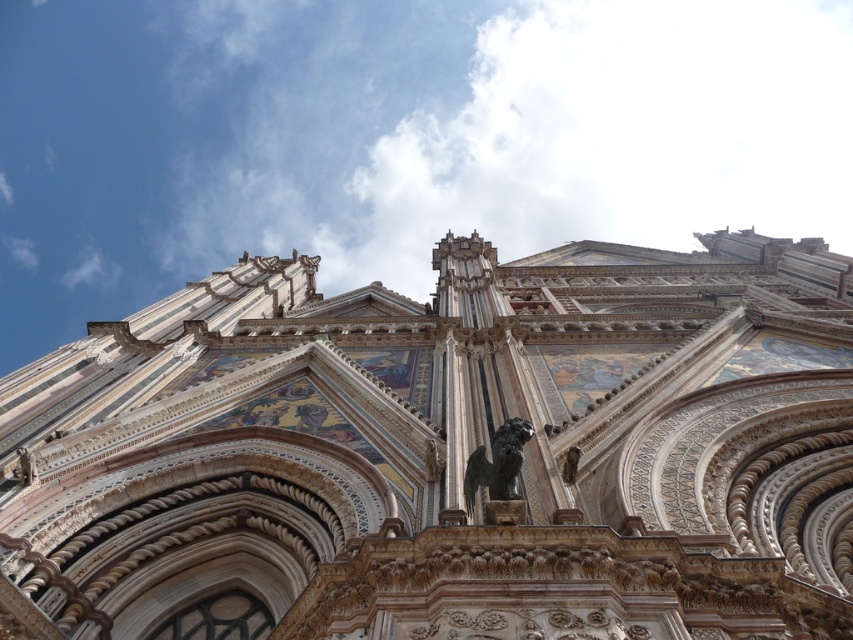
You are an architect analyzing the symmetry of the building depicted in the image. The point at coordinates (445, 452) is marked. Which architectural element does this point correspond to?

The point at coordinates (445, 452) marks the white marble church at center.

You are an architect analyzing the symmetry of the white marble church at center in the image. Based on its position coordinates, does it appear centered horizontally and vertically within the image frame?

The white marble church at center is located at point coordinates 0.708 on the horizontal axis and 0.524 on the vertical axis. Since both values are close to 0.5, which represents the exact center, the church appears nearly centered both horizontally and vertically within the image frame.